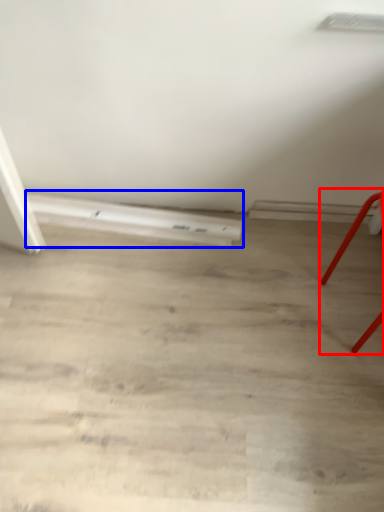
Question: Among these objects, which one is farthest to the camera, furniture (highlighted by a red box) or plank (highlighted by a blue box)?

Choices:
 (A) furniture
 (B) plank

Answer: (B)